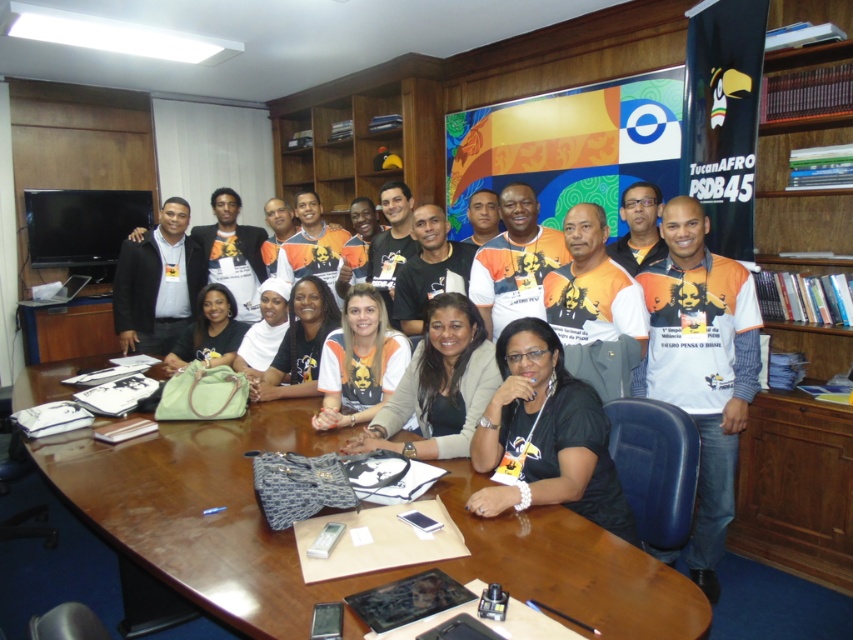
Question: Estimate the real-world distances between objects in this image. Which object is closer to the white printed t-shirt at right?

Choices:
 (A) wooden table at center
 (B) black matte shirt at center

Answer: (B)

Question: Is wooden table at center behind black matte shirt at center?

Choices:
 (A) no
 (B) yes

Answer: (A)

Question: Is wooden table at center to the right of black matte shirt at center from the viewer's perspective?

Choices:
 (A) yes
 (B) no

Answer: (B)

Question: Is wooden table at center wider than white printed t-shirt at right?

Choices:
 (A) yes
 (B) no

Answer: (A)

Question: Among these objects, which one is nearest to the camera?

Choices:
 (A) white printed t-shirt at right
 (B) black matte shirt at center

Answer: (B)

Question: Which point is closer to the camera?

Choices:
 (A) (202, 456)
 (B) (485, 438)
 (C) (672, 392)

Answer: (B)